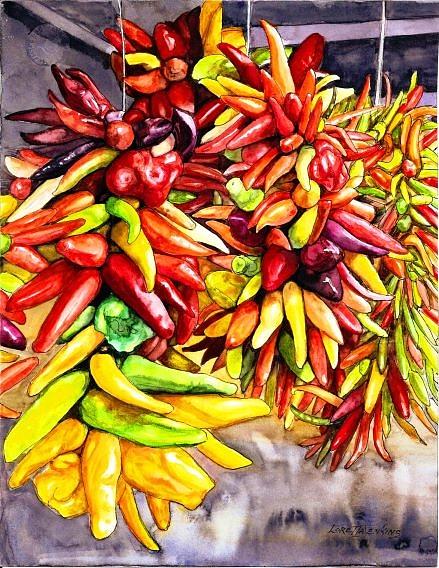
At what (x,y) coordinates should I click in order to perform the action: click on painting. Please return your answer as a coordinate pair (x, y). The image size is (439, 568). Looking at the image, I should click on (216, 221).